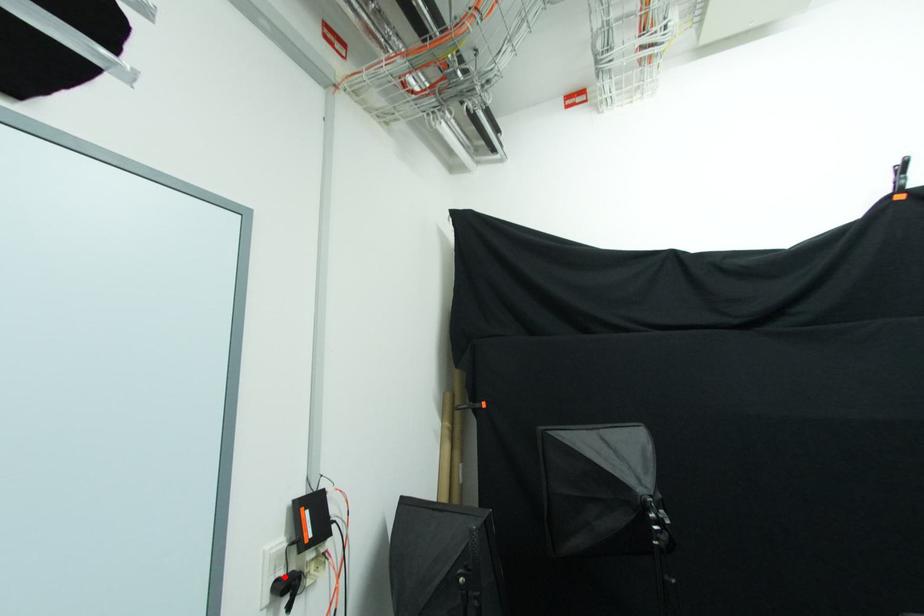
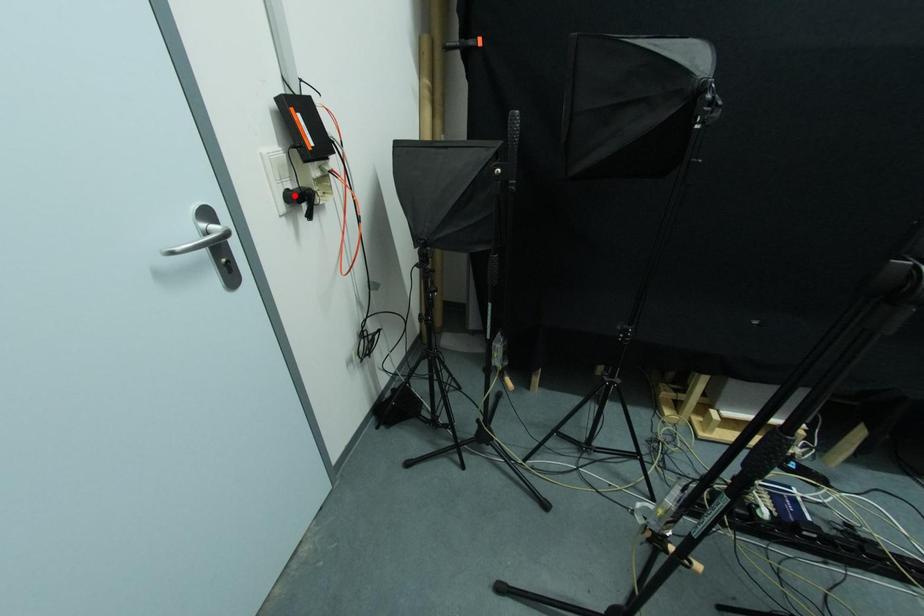
I am providing you with two images of the same scene from different viewpoints. A red point is marked on the first image and another point is marked on the second image. Is the red point in image1 aligned with the point shown in image2?

No